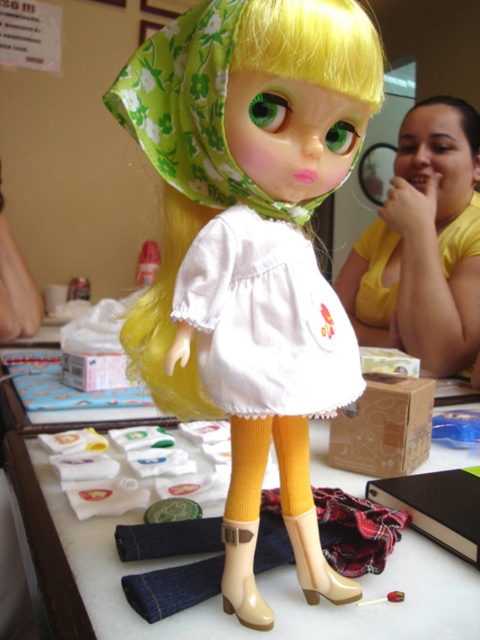
Question: Can you confirm if matte white dress at center is positioned above yellow/yellowish skin tone at upper right?

Choices:
 (A) yes
 (B) no

Answer: (B)

Question: Which object is closer to the camera taking this photo?

Choices:
 (A) matte white dress at center
 (B) yellow/yellowish skin tone at upper right

Answer: (A)

Question: Is matte white dress at center wider than dark brown shiny hair at upper right?

Choices:
 (A) yes
 (B) no

Answer: (B)

Question: Is matte white dress at center smaller than white fabric at center?

Choices:
 (A) yes
 (B) no

Answer: (A)

Question: Which point is farther to the camera?

Choices:
 (A) white fabric at center
 (B) matte white dress at center
 (C) white cotton dress at center

Answer: (A)

Question: Which point is farther to the camera?

Choices:
 (A) (324, 627)
 (B) (471, 138)
 (C) (240, 289)
 (D) (408, 157)

Answer: (D)